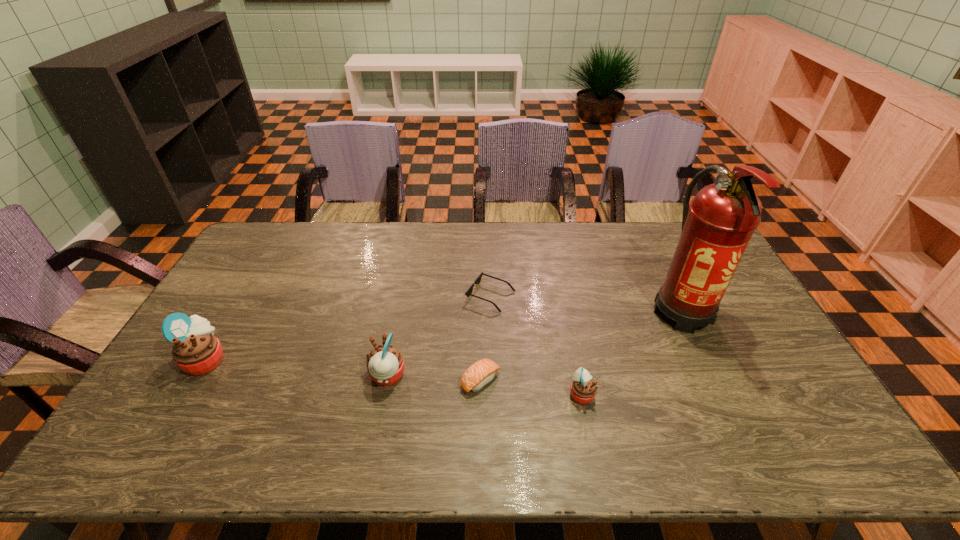
The image size is (960, 540). In order to click on the leftmost muffin in this screenshot , I will do click(x=196, y=351).

Where is `the fifth object from right to left`? This screenshot has width=960, height=540. the fifth object from right to left is located at coordinates (385, 364).

You are a GUI agent. You are given a task and a screenshot of the screen. Output one action in this format:
    pyautogui.click(x=<x>, y=<y>)
    Task: Click on the fourth shortest object
    The image size is (960, 540).
    Given the screenshot: What is the action you would take?
    pyautogui.click(x=385, y=364)

Locate an element on the screen. the shortest muffin is located at coordinates (583, 389).

Where is `the rightmost muffin`? Image resolution: width=960 pixels, height=540 pixels. the rightmost muffin is located at coordinates (583, 389).

Find the location of a particular element. the rightmost object is located at coordinates (715, 232).

The height and width of the screenshot is (540, 960). In order to click on fire extinguisher in this screenshot , I will do `click(715, 232)`.

Locate an element on the screen. Image resolution: width=960 pixels, height=540 pixels. the shortest object is located at coordinates tap(468, 293).

The image size is (960, 540). Find the location of `the fifth tallest object`. the fifth tallest object is located at coordinates (482, 372).

The height and width of the screenshot is (540, 960). I want to click on vacant space located on the front-facing side of the leftmost muffin, so click(362, 359).